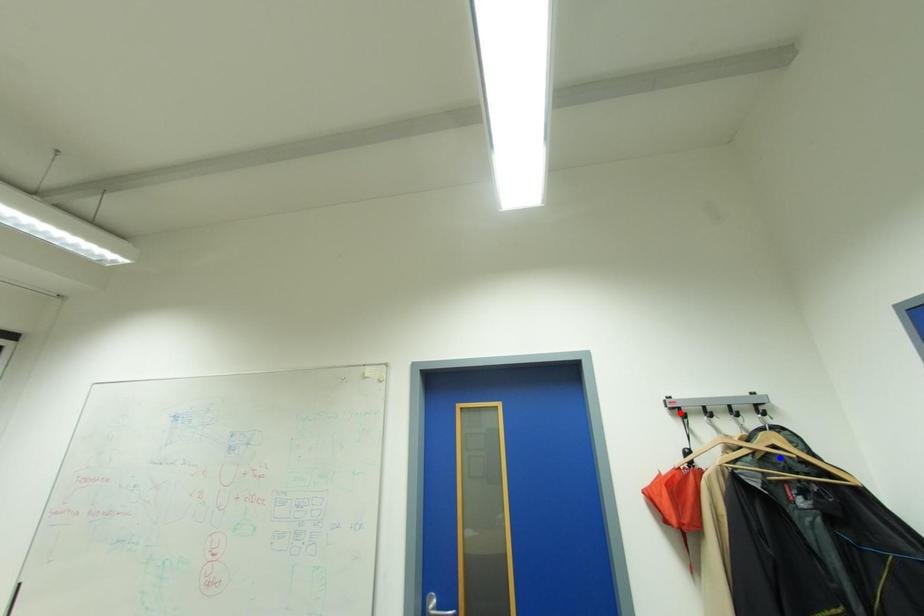
Question: Which of the two points in the image is closer to the camera?

Choices:
 (A) Blue point is closer.
 (B) Red point is closer.

Answer: (A)